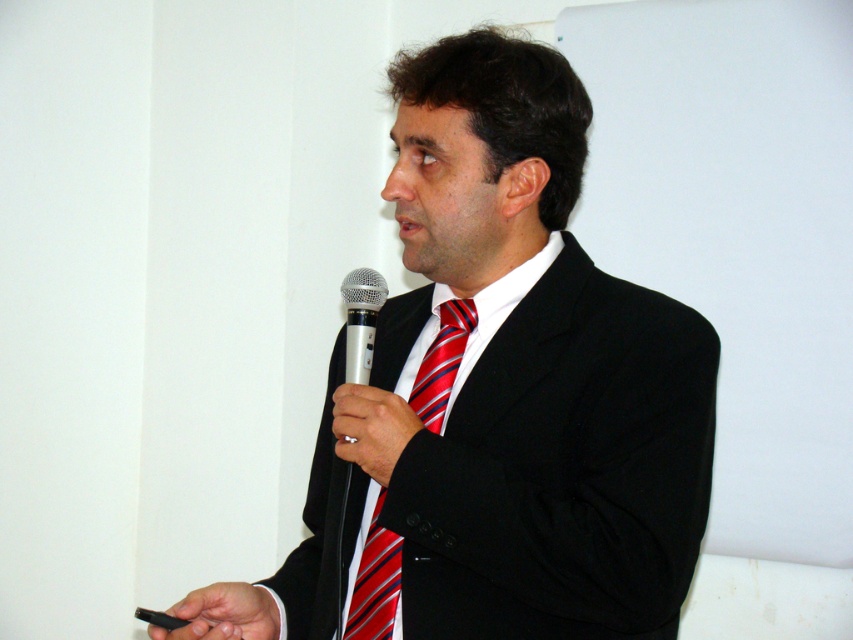
Which is behind, point (672, 429) or point (369, 330)?

The point (369, 330) is behind.

How much distance is there between black matte suit at center and silver metallic microphone at center?

black matte suit at center and silver metallic microphone at center are 9.26 inches apart.

Where is `black matte suit at center`? This screenshot has width=853, height=640. black matte suit at center is located at coordinates (508, 390).

Between smooth black hand at center and black matte usb drive at lower left, which one has less height?

black matte usb drive at lower left is shorter.

Between smooth black hand at center and black matte usb drive at lower left, which one appears on the right side from the viewer's perspective?

smooth black hand at center

Is point (393, 416) in front of point (169, 637)?

Yes, point (393, 416) is closer to viewer.

Locate an element on the screen. smooth black hand at center is located at coordinates (370, 428).

Is red striped tie at center smaller than silver metallic microphone at center?

Actually, red striped tie at center might be larger than silver metallic microphone at center.

How much distance is there between red striped tie at center and silver metallic microphone at center?

red striped tie at center and silver metallic microphone at center are 5.69 inches apart from each other.

What are the coordinates of `red striped tie at center` in the screenshot? It's located at (375, 580).